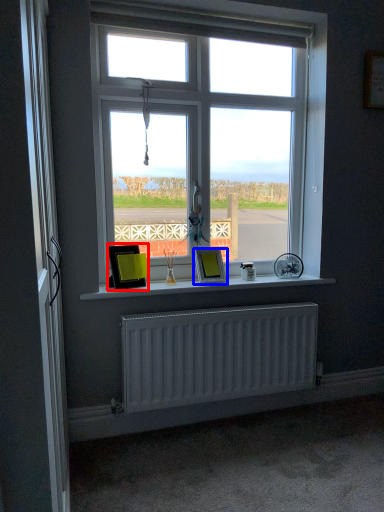
Question: Which point is closer to the camera, picture frame (highlighted by a red box) or picture frame (highlighted by a blue box)?

Choices:
 (A) picture frame
 (B) picture frame

Answer: (A)